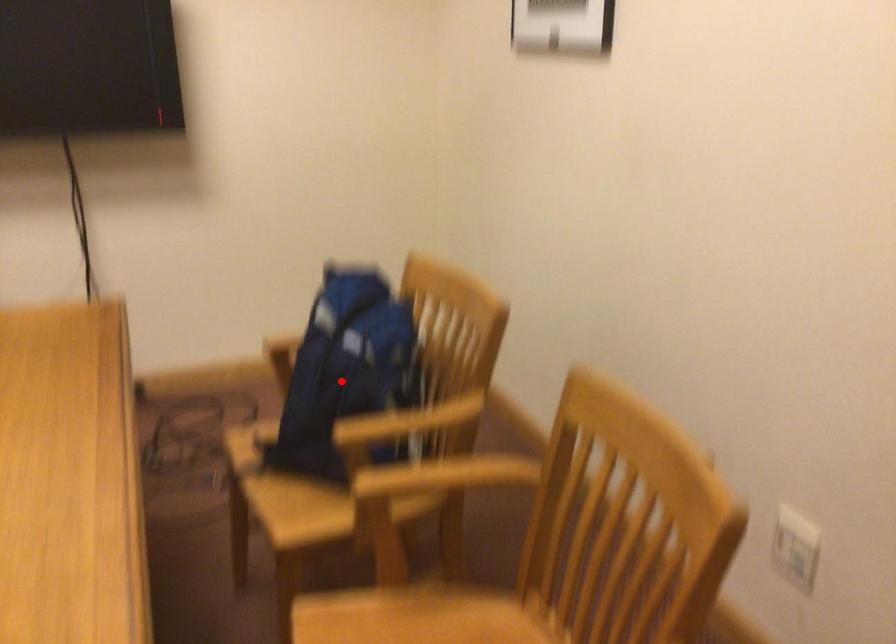
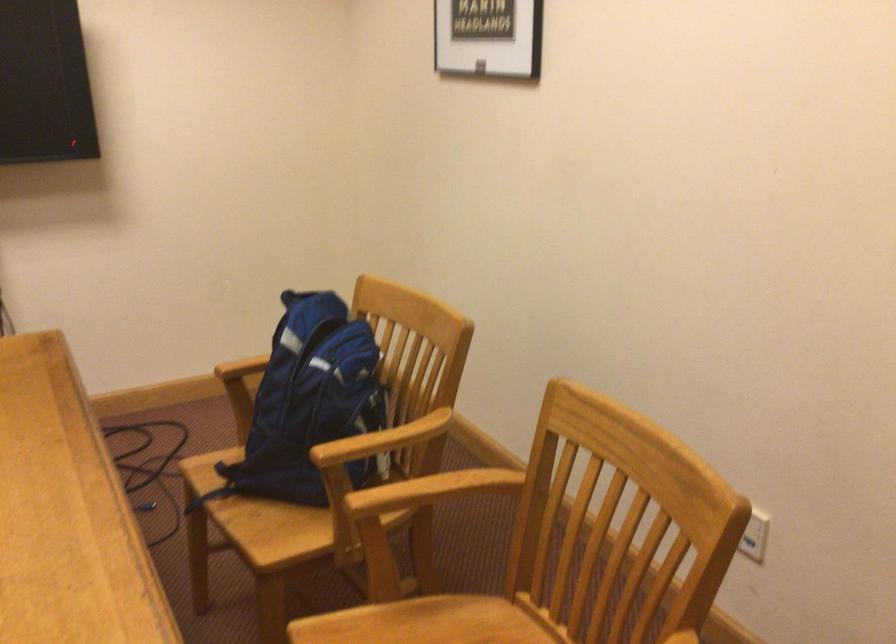
The point at the highlighted location is marked in the first image. Where is the corresponding point in the second image?

(309, 404)